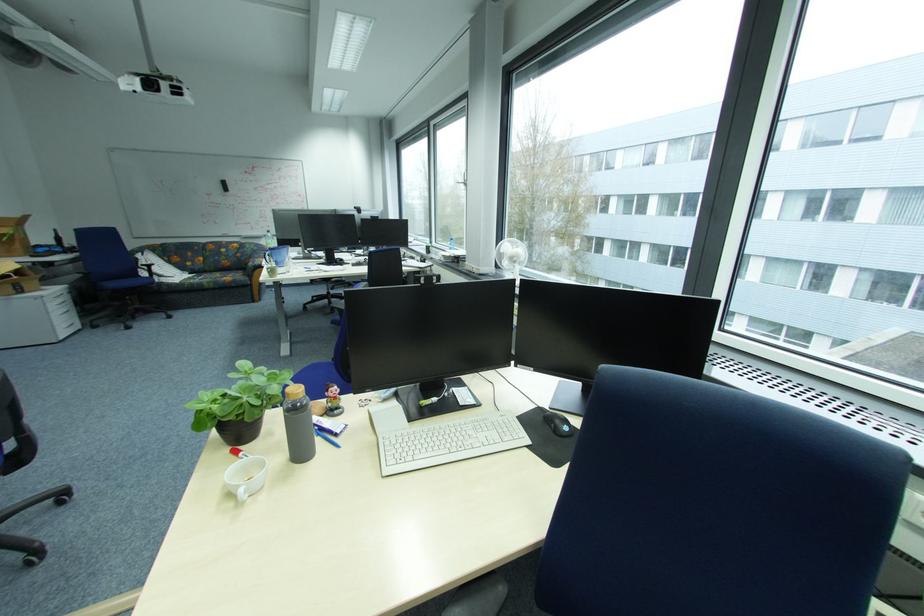
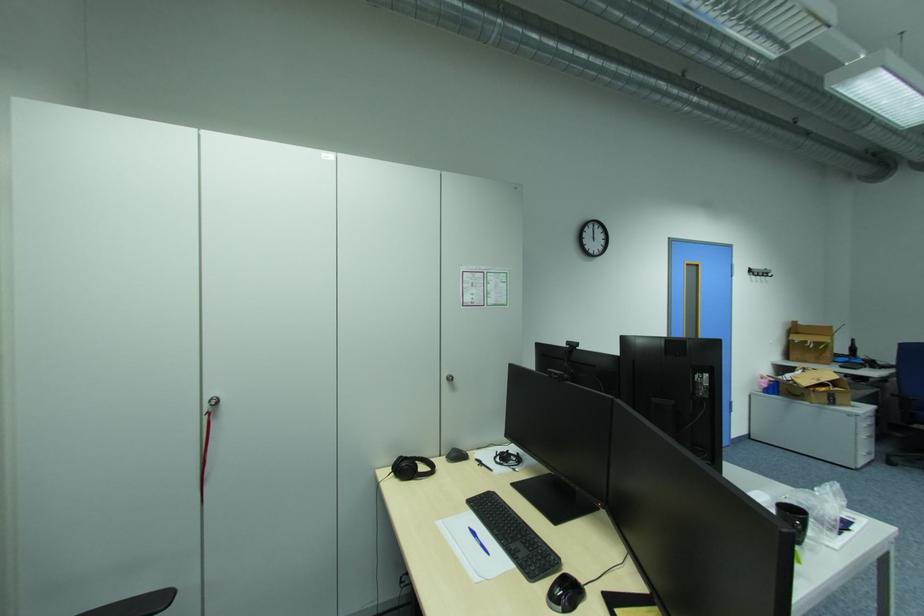
Find the pixel in the second image that matches (x=62, y=245) in the first image.

(855, 354)